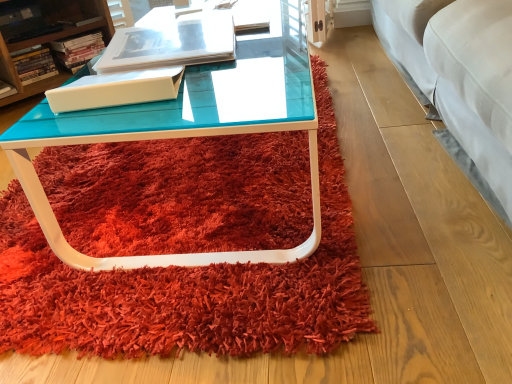
Question: Can you confirm if matte white book at center, the second book when ordered from front to back, is bigger than white plastic container at upper left?

Choices:
 (A) no
 (B) yes

Answer: (A)

Question: Is matte white book at center, the second book when ordered from front to back, located outside white plastic container at upper left?

Choices:
 (A) yes
 (B) no

Answer: (B)

Question: Is matte white book at center, the 1th book when ordered from left to right, looking in the opposite direction of white plastic container at upper left?

Choices:
 (A) yes
 (B) no

Answer: (B)

Question: Is matte white book at center, which is counted as the 5th book, starting from the right, thinner than white plastic container at upper left?

Choices:
 (A) no
 (B) yes

Answer: (B)

Question: From the image's perspective, is matte white book at center, arranged as the 4th book when viewed from the back, above white plastic container at upper left?

Choices:
 (A) yes
 (B) no

Answer: (B)

Question: From the image's perspective, would you say matte white book at center, which is counted as the 5th book, starting from the right, is shown under white plastic container at upper left?

Choices:
 (A) yes
 (B) no

Answer: (A)

Question: From the image's perspective, is matte white book at center, arranged as the 4th book when viewed from the back, under hardcover book at upper left, placed as the second book when sorted from left to right?

Choices:
 (A) yes
 (B) no

Answer: (A)

Question: Is matte white book at center, arranged as the 4th book when viewed from the back, not near hardcover book at upper left, placed as the second book when sorted from left to right?

Choices:
 (A) no
 (B) yes

Answer: (A)

Question: From the image's perspective, is matte white book at center, arranged as the 4th book when viewed from the back, on top of hardcover book at upper left, positioned as the third book in back-to-front order?

Choices:
 (A) no
 (B) yes

Answer: (A)

Question: Is matte white book at center, the second book when ordered from front to back, next to hardcover book at upper left, which is counted as the third book, starting from the front, and touching it?

Choices:
 (A) no
 (B) yes

Answer: (A)

Question: Is matte white book at center, the 1th book when ordered from left to right, taller than hardcover book at upper left, which appears as the fourth book when viewed from the right?

Choices:
 (A) yes
 (B) no

Answer: (B)

Question: Can you confirm if matte white book at center, arranged as the 4th book when viewed from the back, is bigger than hardcover book at upper left, placed as the second book when sorted from left to right?

Choices:
 (A) yes
 (B) no

Answer: (A)

Question: Does matte white book at center, arranged as the 4th book when viewed from the back, have a larger size compared to matte white book at upper left, acting as the first book starting from the back?

Choices:
 (A) no
 (B) yes

Answer: (B)